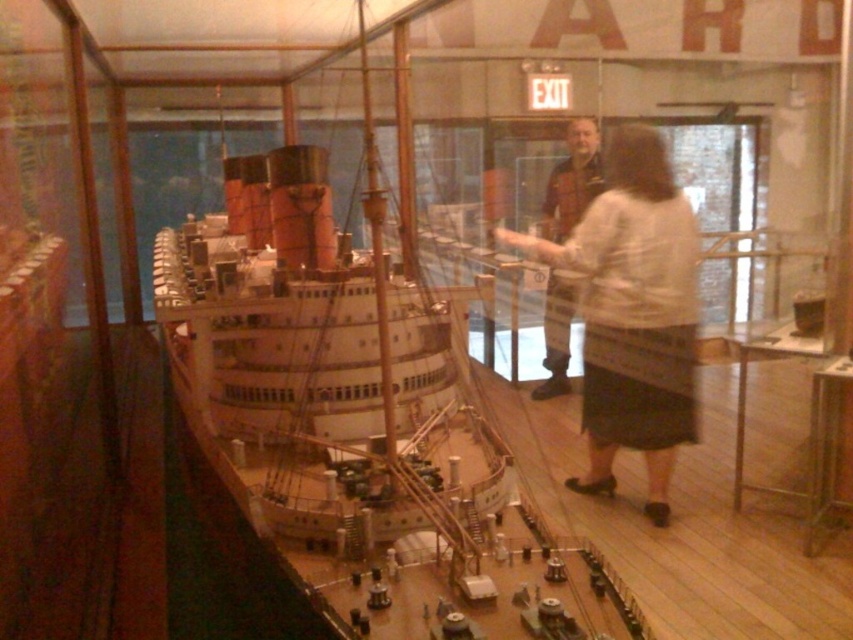
Between white matte ship at center and polished wood floor at center, which one is positioned higher?

polished wood floor at center is higher up.

Does point (387, 456) lie in front of point (553, 371)?

Yes, it is in front of point (553, 371).

Locate an element on the screen. Image resolution: width=853 pixels, height=640 pixels. white matte ship at center is located at coordinates (361, 419).

Does white textured sweater at center have a larger size compared to polished wood floor at center?

Indeed, white textured sweater at center has a larger size compared to polished wood floor at center.

Where is `white textured sweater at center`? white textured sweater at center is located at coordinates (633, 314).

Does white matte ship at center appear under white textured sweater at center?

Actually, white matte ship at center is above white textured sweater at center.

Who is shorter, white matte ship at center or white textured sweater at center?

white textured sweater at center

Is point (370, 264) closer to camera compared to point (671, 275)?

No, it is behind (671, 275).

The image size is (853, 640). Identify the location of white matte ship at center. (361, 419).